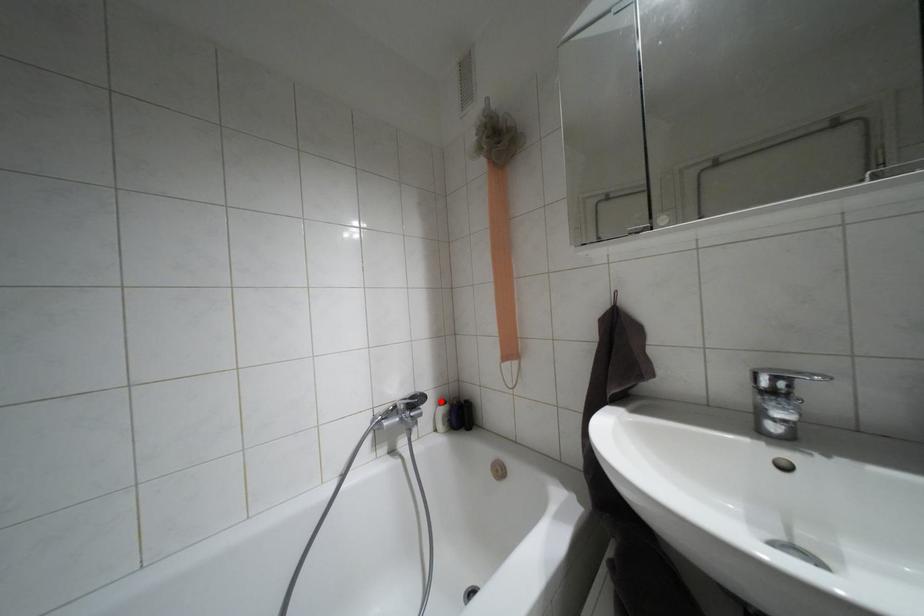
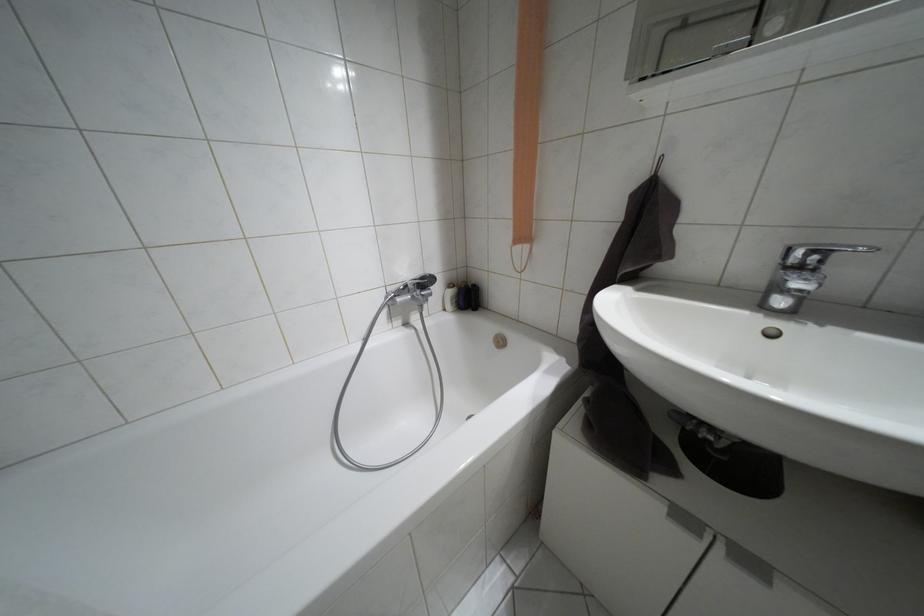
In the second image, find the point that corresponds to the highlighted location in the first image.

(448, 285)